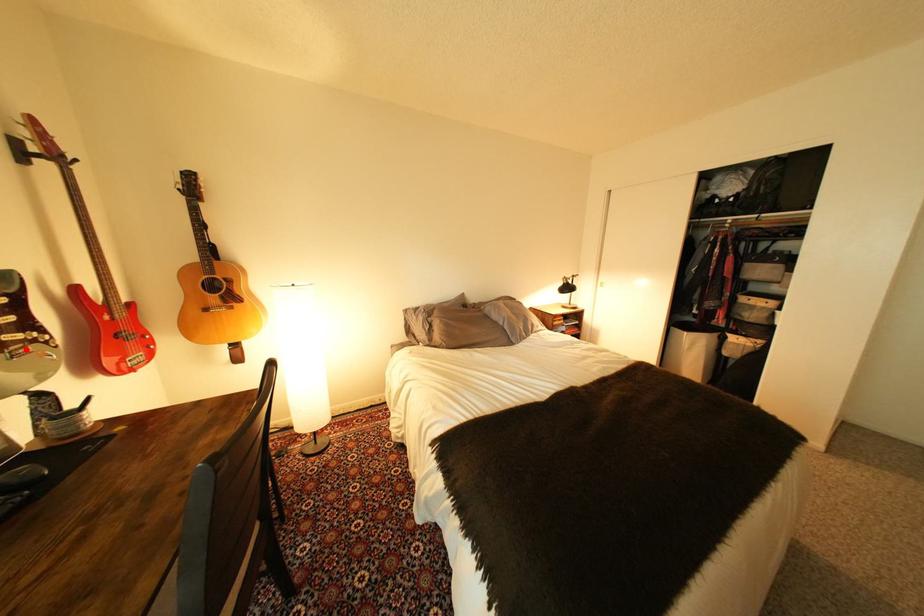
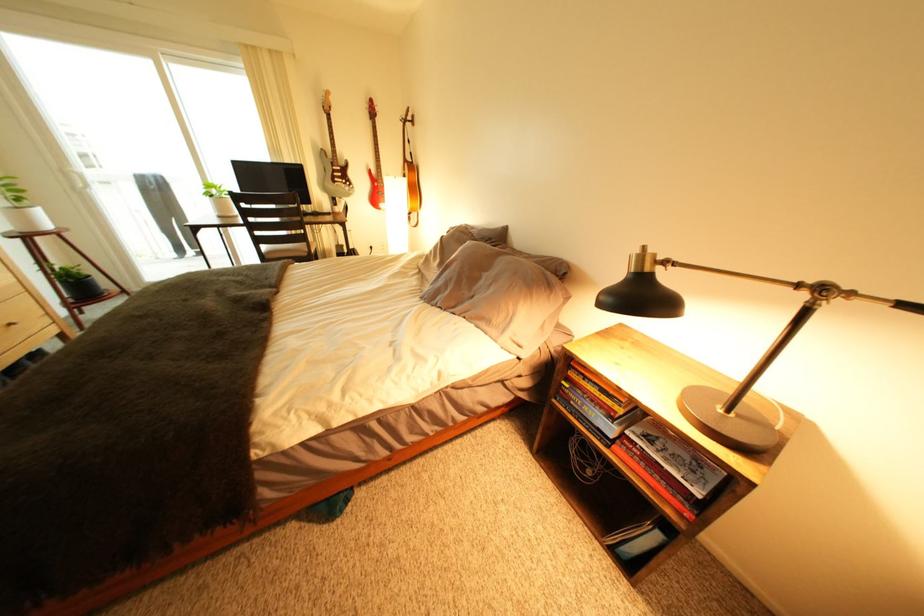
Question: I am providing you with two images of the same scene from different viewpoints. A red point is shown in image1. For the corresponding object point in image2, is it positioned nearer or farther from the camera?

Choices:
 (A) Nearer
 (B) Farther

Answer: (A)